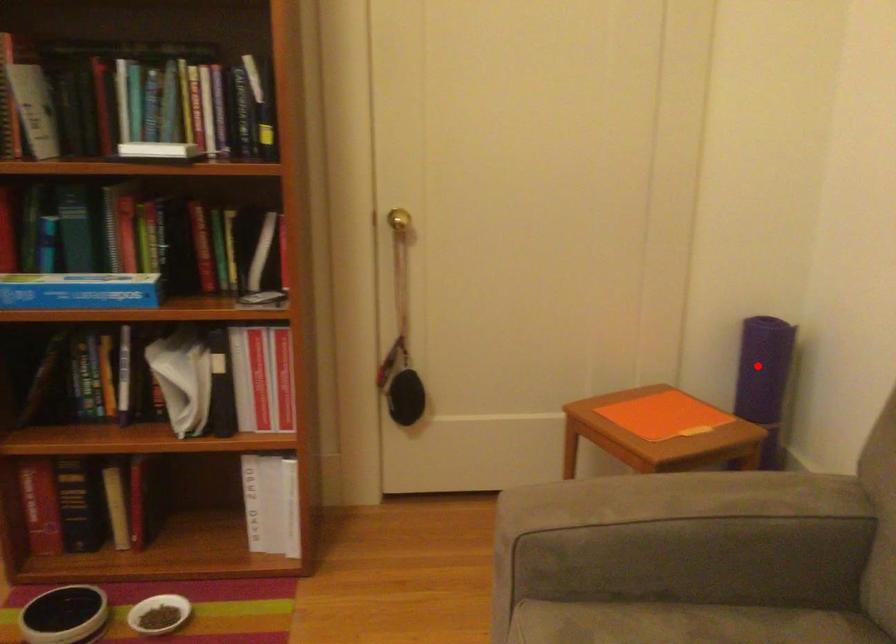
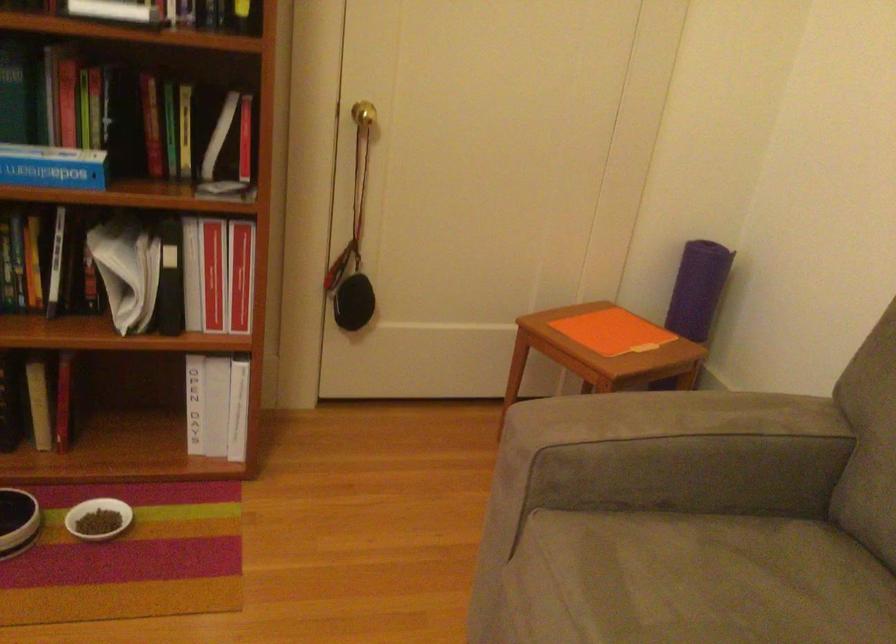
Find the pixel in the second image that matches the highlighted location in the first image.

(698, 289)